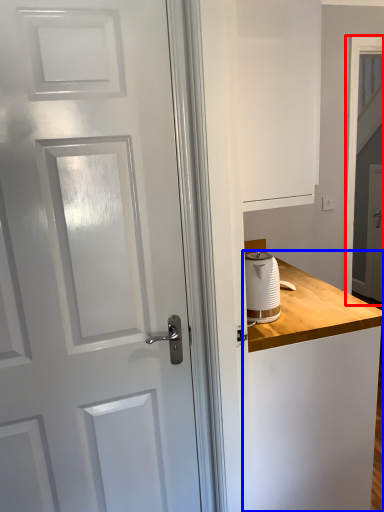
Question: Which of the following is the closest to the observer, screen door (highlighted by a red box) or counter (highlighted by a blue box)?

Choices:
 (A) screen door
 (B) counter

Answer: (B)